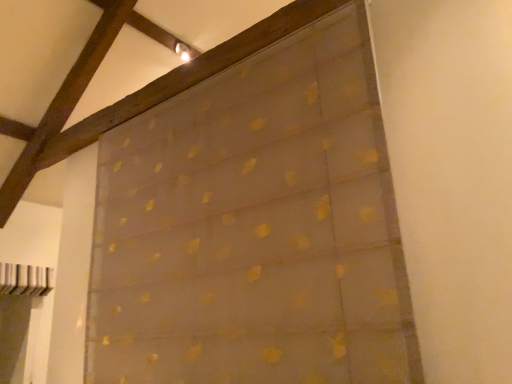
Locate an element on the screen. Image resolution: width=512 pixels, height=384 pixels. translucent gold-patterned curtain at upper center is located at coordinates (255, 227).

The image size is (512, 384). What do you see at coordinates (255, 227) in the screenshot? I see `translucent gold-patterned curtain at upper center` at bounding box center [255, 227].

The image size is (512, 384). I want to click on translucent gold-patterned curtain at upper center, so click(x=255, y=227).